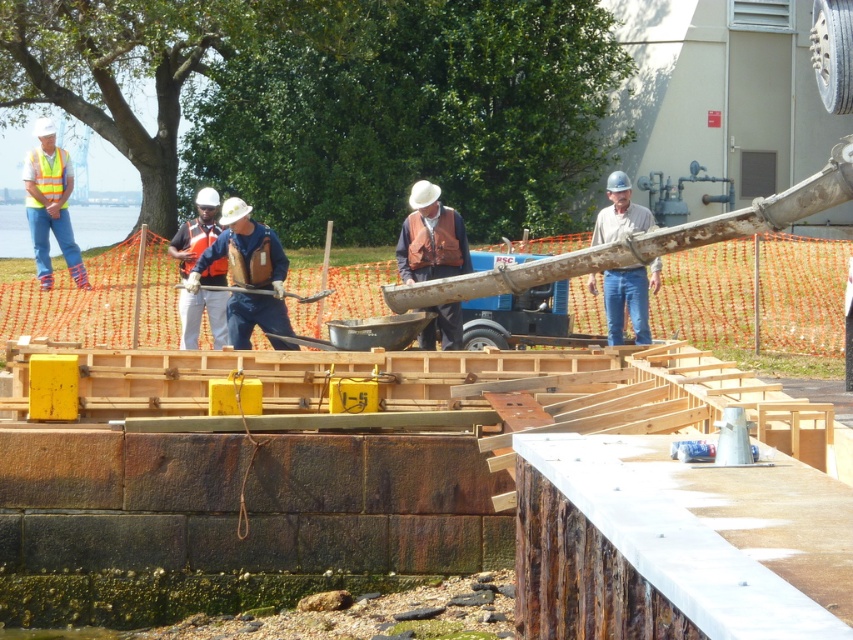
Can you confirm if wooden frame at center is thinner than orange reflective vest at center?

Incorrect, wooden frame at center's width is not less than orange reflective vest at center's.

Is point (190, 609) in front of point (173, 237)?

Yes.

Is point (347, 358) less distant than point (192, 266)?

Yes, point (347, 358) is in front of point (192, 266).

At what (x,y) coordinates should I click in order to perform the action: click on wooden frame at center. Please return your answer as a coordinate pair (x, y). Looking at the image, I should click on (231, 518).

Between matte brown vest at center and high-visibility reflective vest at left, which one is positioned lower?

Positioned lower is high-visibility reflective vest at left.

Does matte brown vest at center have a larger size compared to high-visibility reflective vest at left?

Correct, matte brown vest at center is larger in size than high-visibility reflective vest at left.

Between point (416, 188) and point (49, 125), which one is positioned behind?

The point (49, 125) is behind.

What are the coordinates of `matte brown vest at center` in the screenshot? It's located at (431, 237).

Can you confirm if matte brown vest at center is thinner than orange reflective vest at center?

In fact, matte brown vest at center might be wider than orange reflective vest at center.

Is matte brown vest at center taller than orange reflective vest at center?

Incorrect, matte brown vest at center's height is not larger of orange reflective vest at center's.

Is point (413, 253) positioned in front of point (225, 330)?

Yes, it is in front of point (225, 330).

At what (x,y) coordinates should I click in order to perform the action: click on matte brown vest at center. Please return your answer as a coordinate pair (x, y). Looking at the image, I should click on (431, 237).